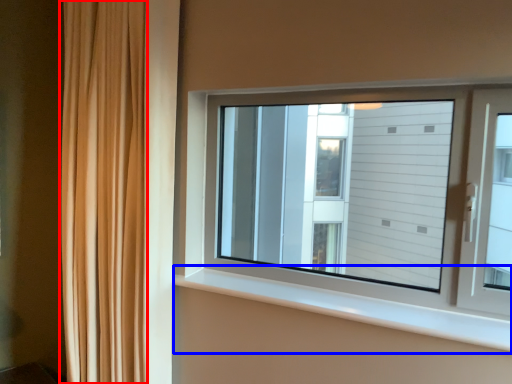
Question: Which of the following is the closest to the observer, curtain (highlighted by a red box) or window sill (highlighted by a blue box)?

Choices:
 (A) curtain
 (B) window sill

Answer: (B)